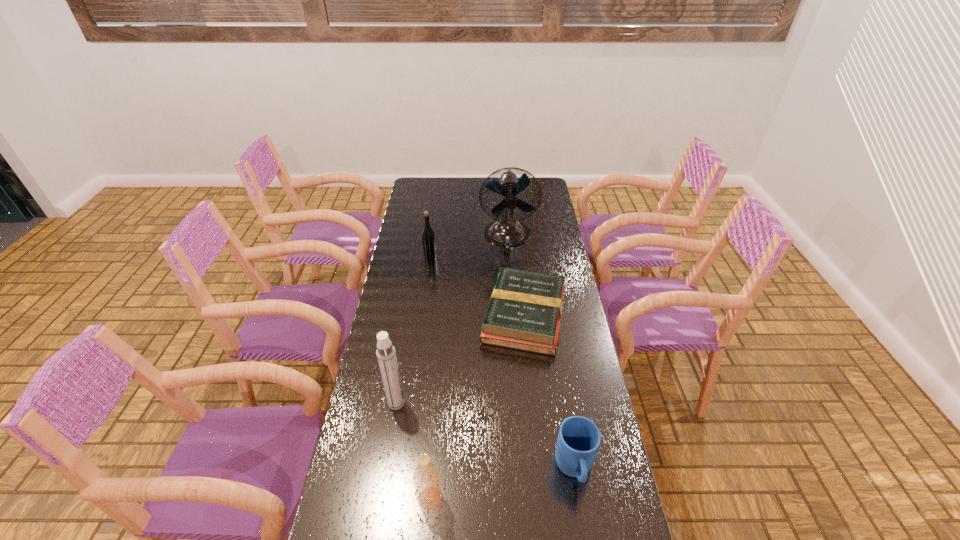
Where is `hardback book`? The height and width of the screenshot is (540, 960). hardback book is located at coordinates (524, 313).

This screenshot has height=540, width=960. Find the location of `free space located on the front-facing side of the tallest object`. free space located on the front-facing side of the tallest object is located at coordinates (513, 303).

This screenshot has height=540, width=960. Find the location of `vacant space positioned 0.230m on the front of the aerosol can`. vacant space positioned 0.230m on the front of the aerosol can is located at coordinates (382, 488).

I want to click on blank space located on the right of the second farthest object, so click(518, 256).

You are a GUI agent. You are given a task and a screenshot of the screen. Output one action in this format:
    pyautogui.click(x=<x>, y=<y>)
    Task: Click on the vacant space situated 0.120m on the left of the nearer beer bottle
    The width and height of the screenshot is (960, 540).
    Given the screenshot: What is the action you would take?
    pyautogui.click(x=371, y=498)

I want to click on free space located 0.070m on the side of the fifth tallest object with the handle, so click(584, 527).

Locate an element on the screen. The width and height of the screenshot is (960, 540). vacant space located 0.200m on the back of the fourth nearest object is located at coordinates (517, 251).

Where is `aerosol can situated at the left edge`? aerosol can situated at the left edge is located at coordinates (386, 355).

Identify the location of beer bottle at the left edge. The width and height of the screenshot is (960, 540). (428, 237).

The image size is (960, 540). In order to click on fan that is at the right edge in this screenshot , I will do `click(506, 231)`.